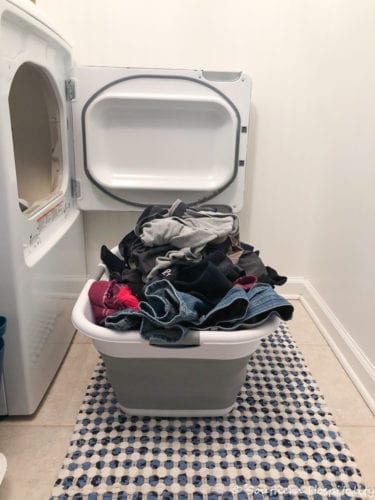
Where is `throw rug`? throw rug is located at coordinates (153, 453).